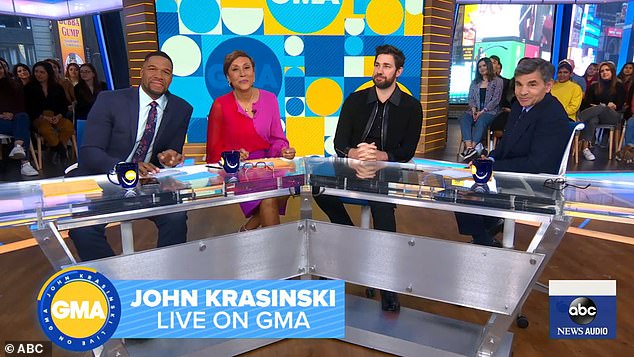
At what (x,y) coordinates should I click in order to perform the action: click on coffee mugs. Please return your answer as a coordinate pair (x, y). The height and width of the screenshot is (357, 634). Looking at the image, I should click on (130, 173), (231, 158), (482, 171).